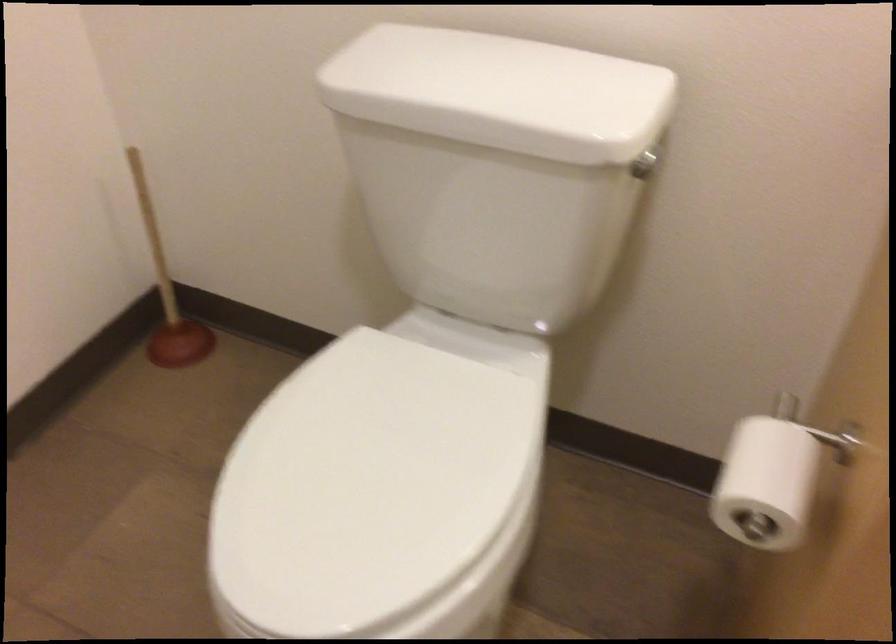
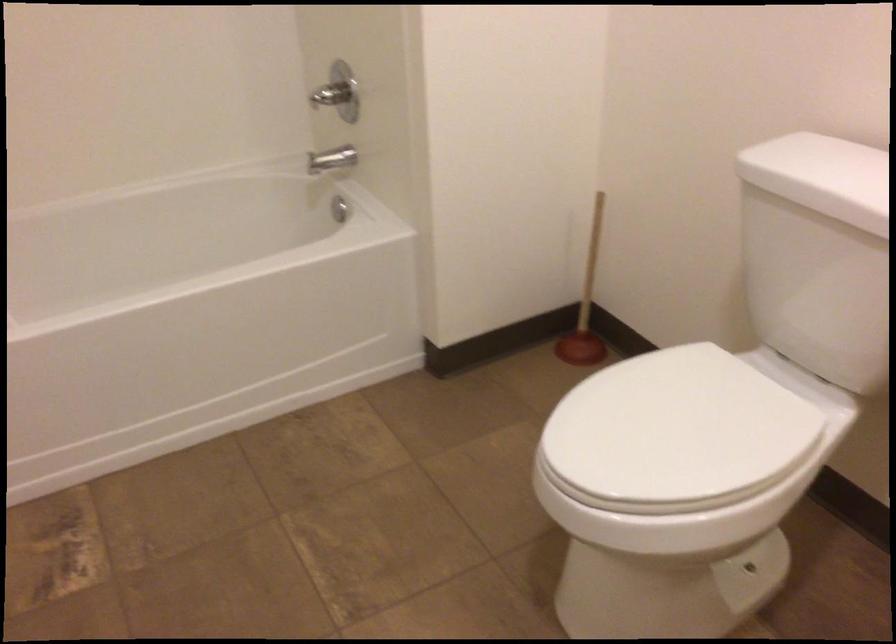
Where in the second image is the point corresponding to (x=375, y=478) from the first image?

(675, 431)